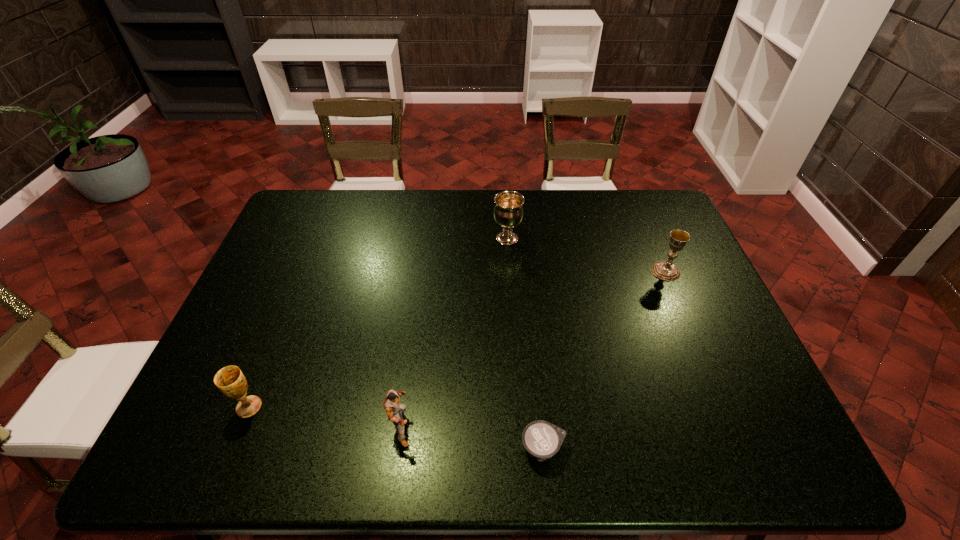
The width and height of the screenshot is (960, 540). What are the coordinates of `vacant space located 0.250m on the back of the leftmost chalice` in the screenshot? It's located at (286, 315).

In order to click on vacant space located on the front-facing side of the fourth object from right to left in this screenshot , I will do `click(574, 427)`.

At what (x,y) coordinates should I click in order to perform the action: click on blank space located on the left of the yogurt. Please return your answer as a coordinate pair (x, y). The height and width of the screenshot is (540, 960). Looking at the image, I should click on (368, 449).

Where is `object at the far edge`? Image resolution: width=960 pixels, height=540 pixels. object at the far edge is located at coordinates (508, 212).

The height and width of the screenshot is (540, 960). Identify the location of puncher present at the near edge. (394, 410).

In order to click on yogurt positioned at the near edge in this screenshot , I will do pyautogui.click(x=541, y=439).

Where is `object at the left edge`? The width and height of the screenshot is (960, 540). object at the left edge is located at coordinates (230, 380).

The height and width of the screenshot is (540, 960). Find the location of `object positioned at the right edge`. object positioned at the right edge is located at coordinates (665, 270).

At what (x,y) coordinates should I click in order to perform the action: click on vacant region at the far edge of the desktop. Please return your answer as a coordinate pair (x, y). Image resolution: width=960 pixels, height=540 pixels. Looking at the image, I should click on (346, 204).

In the image, there is a desktop. Where is `vacant space at the near edge`? This screenshot has height=540, width=960. vacant space at the near edge is located at coordinates (261, 468).